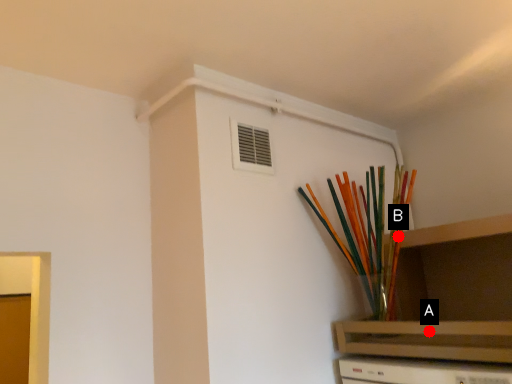
Question: Two points are circled on the image, labeled by A and B beside each circle. Which of the following is the closest to the observer?

Choices:
 (A) A is closer
 (B) B is closer

Answer: (A)